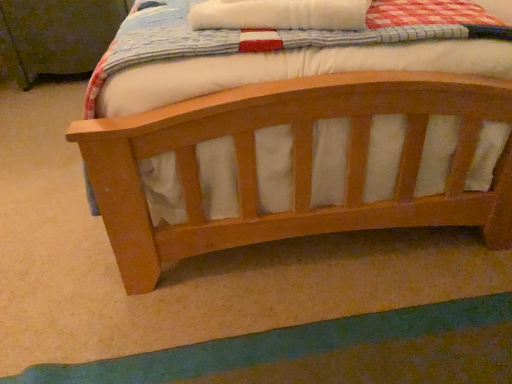
Question: Is wooden changing table at upper left completely or partially inside green fabric at lower center?

Choices:
 (A) no
 (B) yes

Answer: (A)

Question: Considering the relative positions of green fabric at lower center and wooden changing table at upper left in the image provided, is green fabric at lower center in front of wooden changing table at upper left?

Choices:
 (A) yes
 (B) no

Answer: (A)

Question: From a real-world perspective, does green fabric at lower center stand above wooden changing table at upper left?

Choices:
 (A) yes
 (B) no

Answer: (B)

Question: Considering the relative sizes of green fabric at lower center and wooden changing table at upper left in the image provided, is green fabric at lower center smaller than wooden changing table at upper left?

Choices:
 (A) no
 (B) yes

Answer: (B)

Question: Is green fabric at lower center shorter than wooden changing table at upper left?

Choices:
 (A) yes
 (B) no

Answer: (A)

Question: From a real-world perspective, is green fabric at lower center positioned under wooden changing table at upper left based on gravity?

Choices:
 (A) yes
 (B) no

Answer: (A)

Question: Considering the relative sizes of light brown wood bed at center and green fabric at lower center in the image provided, is light brown wood bed at center thinner than green fabric at lower center?

Choices:
 (A) yes
 (B) no

Answer: (B)

Question: Would you say light brown wood bed at center is outside green fabric at lower center?

Choices:
 (A) yes
 (B) no

Answer: (A)

Question: Does light brown wood bed at center appear on the left side of green fabric at lower center?

Choices:
 (A) no
 (B) yes

Answer: (B)

Question: Considering the relative positions of light brown wood bed at center and green fabric at lower center in the image provided, is light brown wood bed at center behind green fabric at lower center?

Choices:
 (A) no
 (B) yes

Answer: (A)

Question: Is light brown wood bed at center taller than green fabric at lower center?

Choices:
 (A) yes
 (B) no

Answer: (B)

Question: Considering the relative positions of light brown wood bed at center and green fabric at lower center in the image provided, is light brown wood bed at center in front of green fabric at lower center?

Choices:
 (A) no
 (B) yes

Answer: (B)

Question: Can you confirm if green fabric at lower center is positioned to the left of light brown wood bed at center?

Choices:
 (A) no
 (B) yes

Answer: (A)